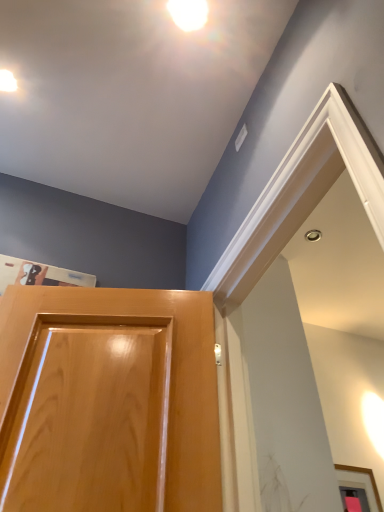
Question: Should I look upward or downward to see glossy wood door at lower left?

Choices:
 (A) up
 (B) down

Answer: (B)

Question: Is glossy wood door at lower left closer to the viewer compared to white glossy droplight at upper center, acting as the first droplight starting from the top?

Choices:
 (A) no
 (B) yes

Answer: (B)

Question: Is glossy wood door at lower left far from white glossy droplight at upper center, the 2th droplight viewed from the left?

Choices:
 (A) yes
 (B) no

Answer: (A)

Question: Is glossy wood door at lower left smaller than white glossy droplight at upper center, acting as the 2th droplight starting from the back?

Choices:
 (A) no
 (B) yes

Answer: (A)

Question: Is glossy wood door at lower left at the right side of white glossy droplight at upper center, the 2th droplight viewed from the left?

Choices:
 (A) no
 (B) yes

Answer: (A)

Question: Considering the relative sizes of glossy wood door at lower left and white glossy droplight at upper center, the 2th droplight viewed from the left, in the image provided, is glossy wood door at lower left bigger than white glossy droplight at upper center, the 2th droplight viewed from the left,?

Choices:
 (A) yes
 (B) no

Answer: (A)

Question: Is glossy wood door at lower left next to white glossy droplight at upper center, acting as the first droplight starting from the top?

Choices:
 (A) yes
 (B) no

Answer: (B)

Question: From the image's perspective, is glossy wood door at lower left over matte white droplight at upper left, which is counted as the 1th droplight, starting from the left?

Choices:
 (A) no
 (B) yes

Answer: (A)

Question: Considering the relative sizes of glossy wood door at lower left and matte white droplight at upper left, which is counted as the first droplight, starting from the bottom, in the image provided, is glossy wood door at lower left shorter than matte white droplight at upper left, which is counted as the first droplight, starting from the bottom,?

Choices:
 (A) yes
 (B) no

Answer: (B)

Question: Does glossy wood door at lower left have a lesser width compared to matte white droplight at upper left, the 2th droplight positioned from the top?

Choices:
 (A) no
 (B) yes

Answer: (A)

Question: Is glossy wood door at lower left in contact with matte white droplight at upper left, which ranks as the first droplight in back-to-front order?

Choices:
 (A) no
 (B) yes

Answer: (A)

Question: Is matte white droplight at upper left, which appears as the 2th droplight when viewed from the front, located within glossy wood door at lower left?

Choices:
 (A) no
 (B) yes

Answer: (A)

Question: Is glossy wood door at lower left positioned far away from matte white droplight at upper left, which is counted as the second droplight, starting from the right?

Choices:
 (A) no
 (B) yes

Answer: (B)

Question: Is the depth of white glossy droplight at upper center, acting as the first droplight starting from the top, less than that of glossy wood door at lower left?

Choices:
 (A) no
 (B) yes

Answer: (A)